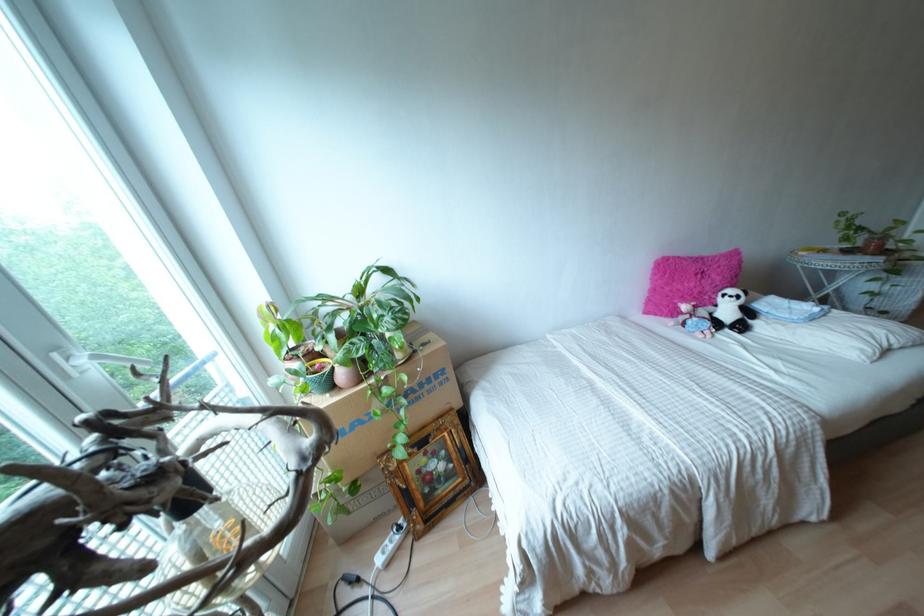
Locate an element on the screen. white bed pillow is located at coordinates (832, 329).